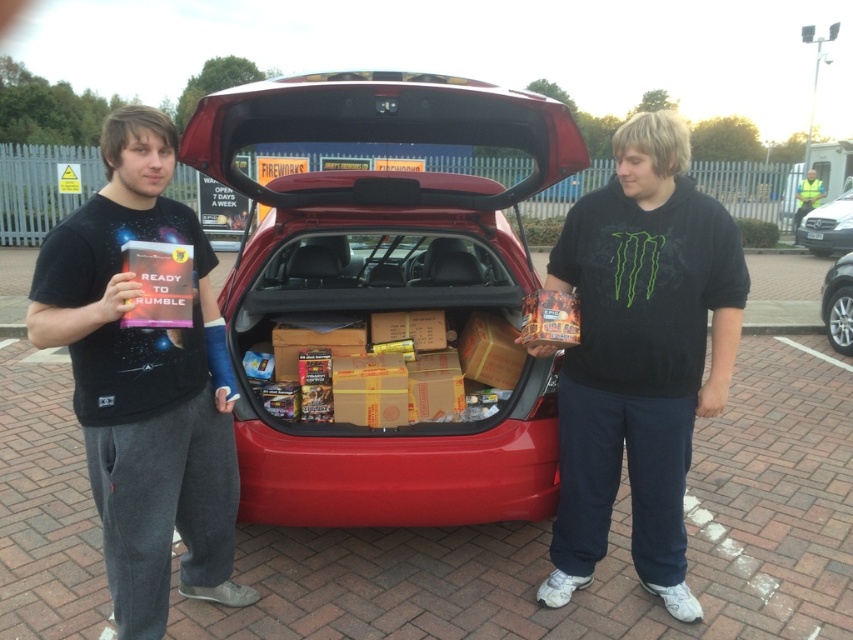
Can you confirm if black cotton t-shirt at left is wider than silver metallic sedan at right?

No, black cotton t-shirt at left is not wider than silver metallic sedan at right.

Who is shorter, black cotton t-shirt at left or silver metallic sedan at right?

Standing shorter between the two is silver metallic sedan at right.

Where is `black cotton t-shirt at left`? The height and width of the screenshot is (640, 853). black cotton t-shirt at left is located at coordinates (144, 381).

Is matte cardboard boxes at center above black cotton t-shirt at center?

Actually, matte cardboard boxes at center is below black cotton t-shirt at center.

Where is `matte cardboard boxes at center`? The width and height of the screenshot is (853, 640). matte cardboard boxes at center is located at coordinates pos(386,296).

The image size is (853, 640). Describe the element at coordinates (386, 296) in the screenshot. I see `matte cardboard boxes at center` at that location.

You are a GUI agent. You are given a task and a screenshot of the screen. Output one action in this format:
    pyautogui.click(x=<x>, y=<y>)
    Task: Click on the matte cardboard boxes at center
    
    Given the screenshot: What is the action you would take?
    pyautogui.click(x=386, y=296)

Who is more distant from viewer, (x=624, y=292) or (x=163, y=513)?

The point (x=624, y=292) is behind.

Is black cotton t-shirt at center thinner than black cotton t-shirt at left?

No, black cotton t-shirt at center is not thinner than black cotton t-shirt at left.

Does point (659, 348) come farther from viewer compared to point (200, 316)?

Yes, point (659, 348) is farther from viewer.

Where is `black cotton t-shirt at center`? The height and width of the screenshot is (640, 853). black cotton t-shirt at center is located at coordinates (640, 355).